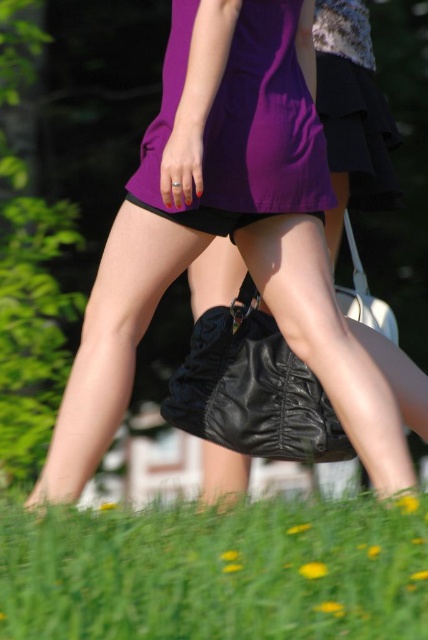
This screenshot has width=428, height=640. In order to click on green grass at lower center in this screenshot , I will do `click(216, 572)`.

Between green grass at lower center and purple satin dress at center, which one is positioned higher?

purple satin dress at center

Does point (308, 589) lie in front of point (259, 60)?

Yes, point (308, 589) is in front of point (259, 60).

Image resolution: width=428 pixels, height=640 pixels. Identify the location of green grass at lower center. (216, 572).